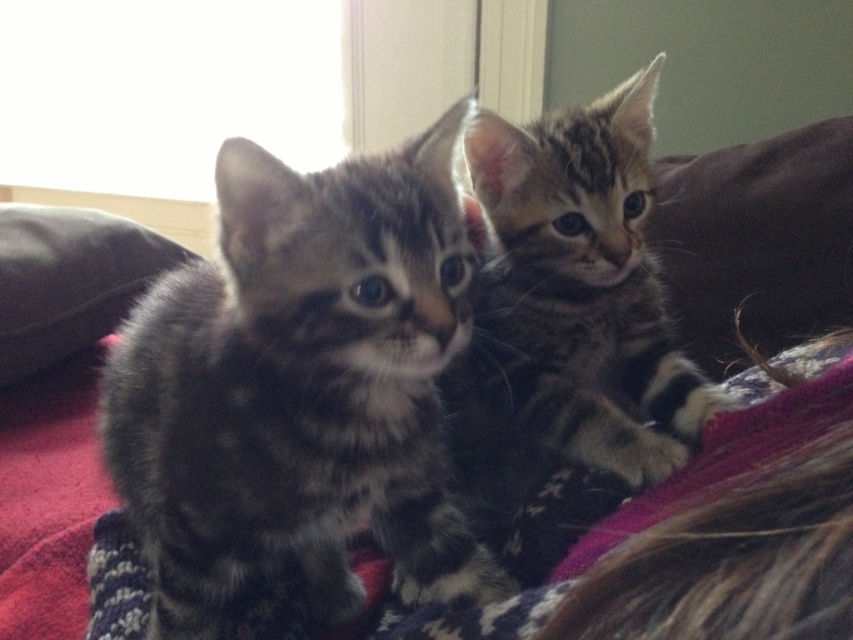
Does gray tabby kitten at center have a greater height compared to tabby fur kitten at center?

Incorrect, gray tabby kitten at center's height is not larger of tabby fur kitten at center's.

What do you see at coordinates (300, 388) in the screenshot? I see `gray tabby kitten at center` at bounding box center [300, 388].

What do you see at coordinates (300, 388) in the screenshot? I see `gray tabby kitten at center` at bounding box center [300, 388].

In order to click on gray tabby kitten at center in this screenshot , I will do `click(300, 388)`.

Is gray tabby kitten at center smaller than brown suede pillow at right?

No, gray tabby kitten at center is not smaller than brown suede pillow at right.

Describe the element at coordinates (300, 388) in the screenshot. I see `gray tabby kitten at center` at that location.

Locate an element on the screen. gray tabby kitten at center is located at coordinates (300, 388).

Is gray tabby kitten at center above black leather pillow at left?

Incorrect, gray tabby kitten at center is not positioned above black leather pillow at left.

Does gray tabby kitten at center appear on the left side of black leather pillow at left?

Incorrect, gray tabby kitten at center is not on the left side of black leather pillow at left.

Where is `gray tabby kitten at center`? gray tabby kitten at center is located at coordinates (300, 388).

Image resolution: width=853 pixels, height=640 pixels. What are the coordinates of `gray tabby kitten at center` in the screenshot? It's located at (300, 388).